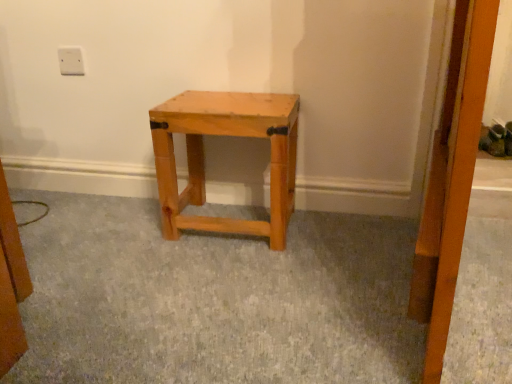
Question: Is natural wood stool at center wider than white plastic outlet at upper left?

Choices:
 (A) no
 (B) yes

Answer: (B)

Question: From a real-world perspective, is natural wood stool at center over white plastic outlet at upper left?

Choices:
 (A) no
 (B) yes

Answer: (A)

Question: Is natural wood stool at center far away from white plastic outlet at upper left?

Choices:
 (A) no
 (B) yes

Answer: (A)

Question: Is natural wood stool at center positioned behind white plastic outlet at upper left?

Choices:
 (A) no
 (B) yes

Answer: (A)

Question: Can you confirm if natural wood stool at center is thinner than white plastic outlet at upper left?

Choices:
 (A) no
 (B) yes

Answer: (A)

Question: Is white plastic outlet at upper left completely or partially inside natural wood stool at center?

Choices:
 (A) no
 (B) yes

Answer: (A)

Question: Is white plastic outlet at upper left bigger than natural wood stool at center?

Choices:
 (A) no
 (B) yes

Answer: (A)

Question: From the image's perspective, is white plastic outlet at upper left below natural wood stool at center?

Choices:
 (A) yes
 (B) no

Answer: (B)

Question: Are white plastic outlet at upper left and natural wood stool at center beside each other?

Choices:
 (A) no
 (B) yes

Answer: (A)

Question: Does white plastic outlet at upper left have a smaller size compared to natural wood stool at center?

Choices:
 (A) no
 (B) yes

Answer: (B)

Question: Does white plastic outlet at upper left have a greater width compared to natural wood stool at center?

Choices:
 (A) yes
 (B) no

Answer: (B)

Question: Does white plastic outlet at upper left contain natural wood stool at center?

Choices:
 (A) yes
 (B) no

Answer: (B)

Question: Relative to white plastic outlet at upper left, is natural wood stool at center in front or behind?

Choices:
 (A) behind
 (B) front

Answer: (B)